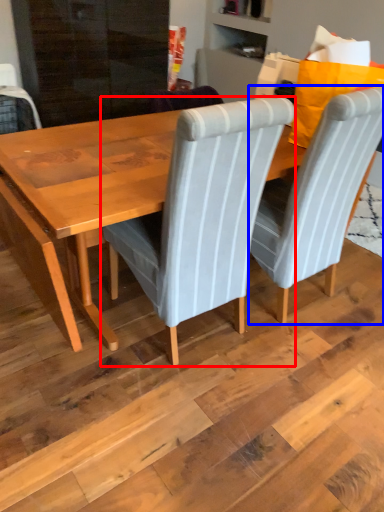
Question: Which object is closer to the camera taking this photo, chair (highlighted by a red box) or chair (highlighted by a blue box)?

Choices:
 (A) chair
 (B) chair

Answer: (A)